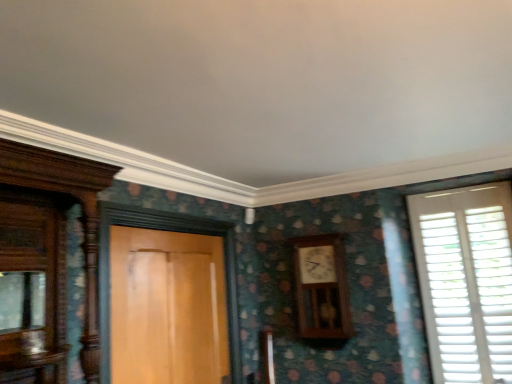
This screenshot has height=384, width=512. What do you see at coordinates (167, 307) in the screenshot?
I see `wooden door at center` at bounding box center [167, 307].

This screenshot has height=384, width=512. Describe the element at coordinates (321, 287) in the screenshot. I see `wooden clock at center-right` at that location.

Where is `white wooden shutters at right`? white wooden shutters at right is located at coordinates (466, 280).

Identify the location of wooden door at center. (167, 307).

Which of these two, wooden clock at center-right or white wooden shutters at right, is smaller?

wooden clock at center-right.

Looking at this image, from the image's perspective, is wooden clock at center-right positioned above or below white wooden shutters at right?

wooden clock at center-right is below white wooden shutters at right.

Who is taller, wooden clock at center-right or white wooden shutters at right?

white wooden shutters at right is taller.

Considering the sizes of objects wooden clock at center-right and white wooden shutters at right in the image provided, who is wider, wooden clock at center-right or white wooden shutters at right?

Wider between the two is wooden clock at center-right.

Is white wooden shutters at right located outside wooden clock at center-right?

Yes, white wooden shutters at right is outside of wooden clock at center-right.

What's the angular difference between white wooden shutters at right and wooden clock at center-right's facing directions?

The angular difference between white wooden shutters at right and wooden clock at center-right is 0.0158 degrees.

From a real-world perspective, does white wooden shutters at right stand above wooden clock at center-right?

No, from a real-world perspective, white wooden shutters at right is not over wooden clock at center-right

Is the depth of white wooden shutters at right less than that of wooden clock at center-right?

That is True.

Can you confirm if white wooden shutters at right is bigger than wooden door at center?

Incorrect, white wooden shutters at right is not larger than wooden door at center.

In terms of height, does white wooden shutters at right look taller or shorter compared to wooden door at center?

Considering their sizes, white wooden shutters at right has more height than wooden door at center.

Is white wooden shutters at right positioned with its back to wooden door at center?

No, white wooden shutters at right is not facing away from wooden door at center.

From the image's perspective, between white wooden shutters at right and wooden door at center, which one is located above?

From the image's view, white wooden shutters at right is above.

Looking at this image, can you confirm if wooden door at center is bigger than wooden clock at center-right?

Yes, wooden door at center is bigger than wooden clock at center-right.

In the scene shown: Would you say wooden door at center contains wooden clock at center-right?

That's incorrect, wooden clock at center-right is not inside wooden door at center.

Considering the sizes of objects wooden door at center and wooden clock at center-right in the image provided, who is shorter, wooden door at center or wooden clock at center-right?

With less height is wooden clock at center-right.

Is wooden door at center at the back of wooden clock at center-right?

wooden clock at center-right is not turned away from wooden door at center.

Which of these two, wooden clock at center-right or wooden door at center, is bigger?

wooden door at center is bigger.

Does wooden clock at center-right lie behind wooden door at center?

Yes, wooden clock at center-right is behind wooden door at center.

Is wooden door at center taller or shorter than white wooden shutters at right?

In the image, wooden door at center appears to be shorter than white wooden shutters at right.

Which of these two, wooden door at center or white wooden shutters at right, is wider?

Wider between the two is wooden door at center.

Is point (204, 286) farther from camera compared to point (434, 287)?

That is False.

Identify the location of clock that is on the left side of white wooden shutters at right. (321, 287).

I want to click on window in front of the wooden clock at center-right, so click(466, 280).

Estimate the real-world distances between objects in this image. Which object is closer to wooden door at center, white wooden shutters at right or wooden clock at center-right?

wooden clock at center-right lies closer to wooden door at center than the other object.

Considering their positions, is white wooden shutters at right positioned closer to wooden clock at center-right than wooden door at center?

white wooden shutters at right.

Based on their spatial positions, is wooden door at center or white wooden shutters at right further from wooden clock at center-right?

wooden door at center is positioned further to the anchor wooden clock at center-right.

Based on their spatial positions, is wooden clock at center-right or wooden door at center further from white wooden shutters at right?

Based on the image, wooden door at center appears to be further to white wooden shutters at right.

From the image, which object appears to be farther from wooden door at center, wooden clock at center-right or white wooden shutters at right?

white wooden shutters at right.

Considering their positions, is wooden door at center positioned closer to white wooden shutters at right than wooden clock at center-right?

wooden clock at center-right lies closer to white wooden shutters at right than the other object.

Locate an element on the screen. The image size is (512, 384). clock situated between wooden door at center and white wooden shutters at right from left to right is located at coordinates (321, 287).